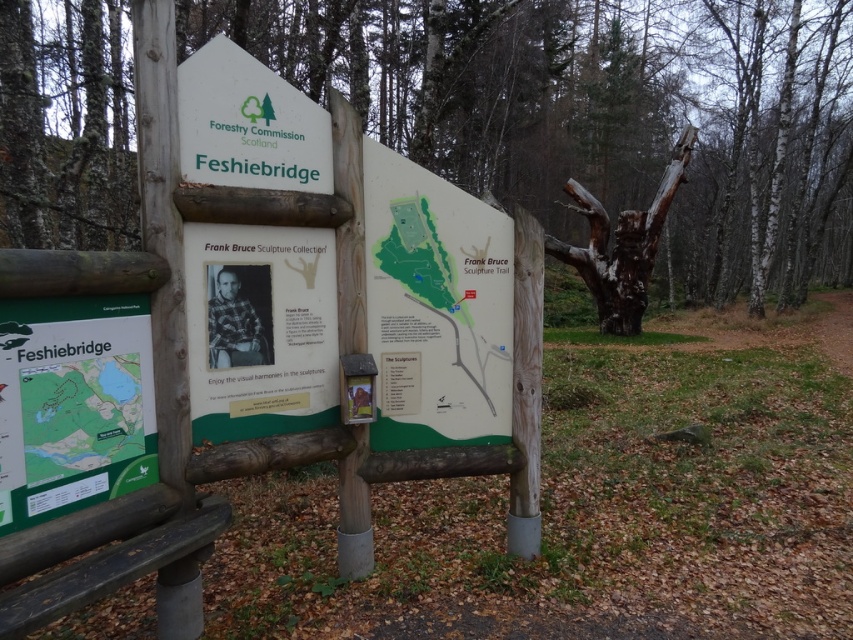
Question: Can you confirm if brown rough bark tree at center is positioned to the right of white plastic sign at upper center?

Choices:
 (A) yes
 (B) no

Answer: (A)

Question: Does green matte map at lower left have a greater width compared to dark gray wood bench at lower left?

Choices:
 (A) yes
 (B) no

Answer: (B)

Question: Which point is farther to the camera?

Choices:
 (A) (310, 116)
 (B) (389, 330)
 (C) (93, 323)
 (D) (238, 419)

Answer: (B)

Question: Which object appears farthest from the camera in this image?

Choices:
 (A) green matte sign at center
 (B) green matte map at lower left
 (C) white plastic sign at upper center
 (D) dark gray wood bench at lower left

Answer: (A)

Question: Does brown rough bark tree at center appear under white plastic sign at upper center?

Choices:
 (A) yes
 (B) no

Answer: (B)

Question: Estimate the real-world distances between objects in this image. Which object is closer to the green matte map at lower left?

Choices:
 (A) green paper map at center
 (B) dark gray wood bench at lower left

Answer: (B)